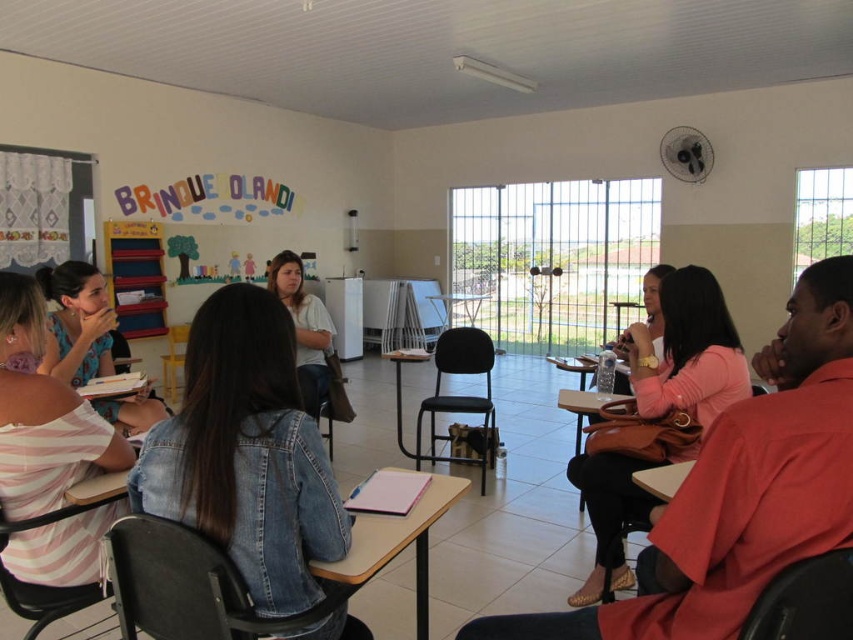
Question: From the image, what is the correct spatial relationship of denim jacket at center in relation to matte black shirt at upper left?

Choices:
 (A) left
 (B) right

Answer: (B)

Question: Observing the image, what is the correct spatial positioning of pink fabric purse at center in reference to pink striped shirt at left?

Choices:
 (A) right
 (B) left

Answer: (A)

Question: Which point is closer to the camera?

Choices:
 (A) (828, 476)
 (B) (201, 396)
 (C) (33, 474)
 (D) (422, 612)

Answer: (A)

Question: Which object is closer to the camera taking this photo?

Choices:
 (A) pink striped shirt at left
 (B) matte black shirt at upper left

Answer: (A)

Question: Which of the following is the closest to the observer?

Choices:
 (A) (598, 468)
 (B) (68, 362)
 (C) (419, 563)
 (D) (32, 387)

Answer: (D)

Question: Is pink striped shirt at left bigger than wooden desk at center?

Choices:
 (A) yes
 (B) no

Answer: (B)